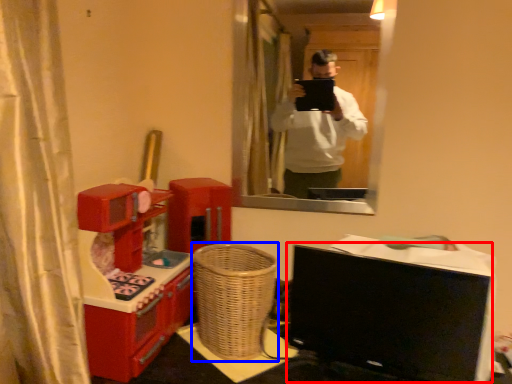
Question: Which object appears farthest to the camera in this image, computer monitor (highlighted by a red box) or basket (highlighted by a blue box)?

Choices:
 (A) computer monitor
 (B) basket

Answer: (B)